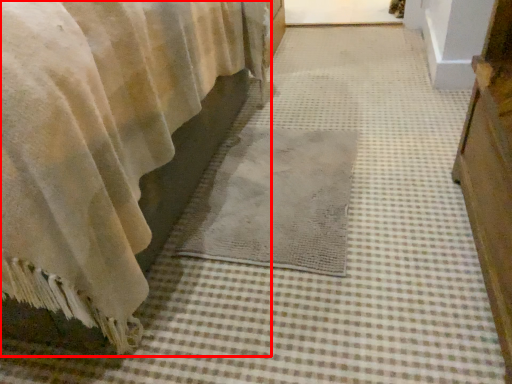
Question: From the image's perspective, what is the correct spatial relationship of curtain (annotated by the red box) in relation to mat?

Choices:
 (A) above
 (B) below

Answer: (A)